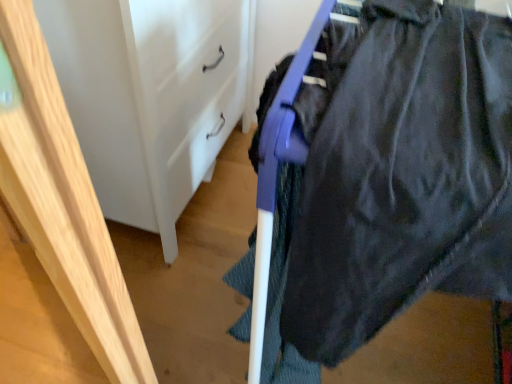
Question: Does white matte/file cabinet at center appear on the left side of dark matte fabric at upper right?

Choices:
 (A) yes
 (B) no

Answer: (A)

Question: Could you tell me if white matte/file cabinet at center is facing dark matte fabric at upper right?

Choices:
 (A) no
 (B) yes

Answer: (B)

Question: From a real-world perspective, is white matte/file cabinet at center over dark matte fabric at upper right?

Choices:
 (A) no
 (B) yes

Answer: (A)

Question: Is white matte/file cabinet at center in front of dark matte fabric at upper right?

Choices:
 (A) yes
 (B) no

Answer: (B)

Question: From the image's perspective, is white matte/file cabinet at center below dark matte fabric at upper right?

Choices:
 (A) yes
 (B) no

Answer: (B)

Question: From a real-world perspective, is white matte/file cabinet at center above or below dark matte fabric at upper right?

Choices:
 (A) below
 (B) above

Answer: (A)

Question: Is white matte/file cabinet at center spatially inside dark matte fabric at upper right, or outside of it?

Choices:
 (A) inside
 (B) outside

Answer: (B)

Question: Considering their positions, is white matte/file cabinet at center located in front of or behind dark matte fabric at upper right?

Choices:
 (A) behind
 (B) front

Answer: (A)

Question: Looking at the image, does white matte/file cabinet at center seem bigger or smaller compared to dark matte fabric at upper right?

Choices:
 (A) small
 (B) big

Answer: (A)

Question: In terms of width, does light wood frame at left look wider or thinner when compared to dark matte fabric at upper right?

Choices:
 (A) thin
 (B) wide

Answer: (A)

Question: In the image, is light wood frame at left positioned in front of or behind dark matte fabric at upper right?

Choices:
 (A) front
 (B) behind

Answer: (A)

Question: From the image's perspective, is light wood frame at left above or below dark matte fabric at upper right?

Choices:
 (A) below
 (B) above

Answer: (A)

Question: Is light wood frame at left taller or shorter than dark matte fabric at upper right?

Choices:
 (A) tall
 (B) short

Answer: (A)

Question: Is point (39, 34) closer or farther from the camera than point (139, 107)?

Choices:
 (A) closer
 (B) farther

Answer: (A)

Question: Is light wood frame at left to the left or to the right of white matte/file cabinet at center in the image?

Choices:
 (A) left
 (B) right

Answer: (A)